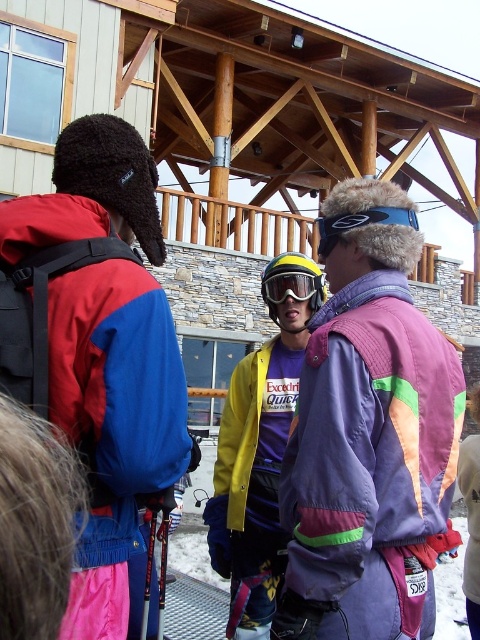
Question: Can you confirm if yellow matte jacket at center is thinner than clear plastic goggles at center?

Choices:
 (A) yes
 (B) no

Answer: (B)

Question: Which is nearer to the matte blue jacket at center?

Choices:
 (A) clear plastic goggles at center
 (B) purple fleece jacket at center
 (C) yellow matte jacket at center

Answer: (B)

Question: Which point appears farthest from the camera in this image?

Choices:
 (A) coord(384,550)
 (B) coord(240,480)
 (C) coord(266,288)
 (D) coord(3,234)

Answer: (C)

Question: Which point appears farthest from the camera in this image?

Choices:
 (A) (224, 573)
 (B) (307, 284)
 (C) (97, 406)

Answer: (B)

Question: Does matte blue jacket at center appear over yellow matte jacket at center?

Choices:
 (A) yes
 (B) no

Answer: (A)

Question: Can you confirm if purple fleece jacket at center is positioned above matte blue jacket at center?

Choices:
 (A) no
 (B) yes

Answer: (A)